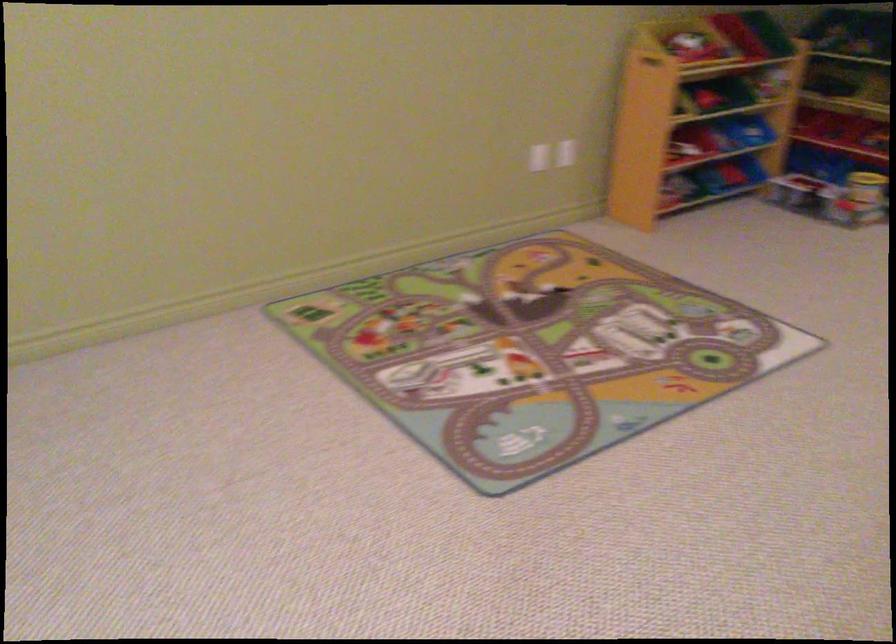
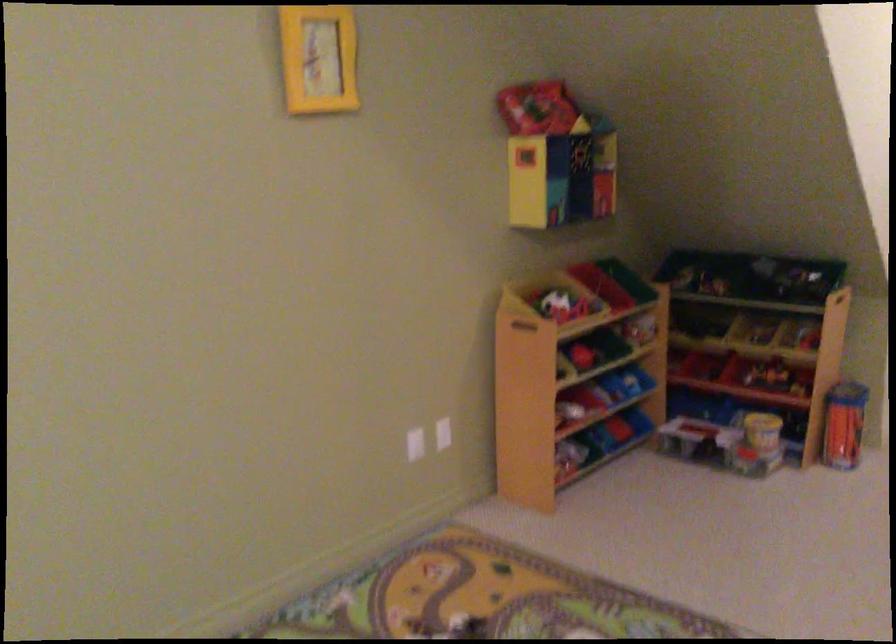
Question: What movement of the cameraman would produce the second image?

Choices:
 (A) Left
 (B) Right
 (C) Forward
 (D) Backward

Answer: (C)